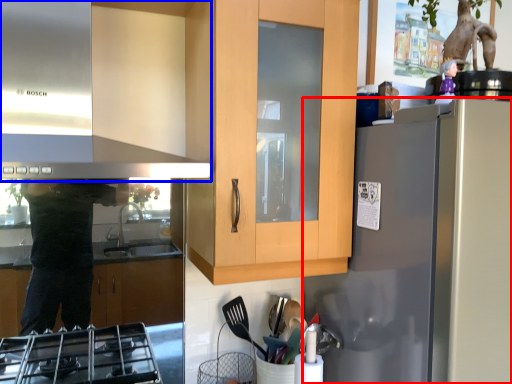
Question: Among these objects, which one is nearest to the camera, refrigerator (highlighted by a red box) or exhaust hood (highlighted by a blue box)?

Choices:
 (A) refrigerator
 (B) exhaust hood

Answer: (B)